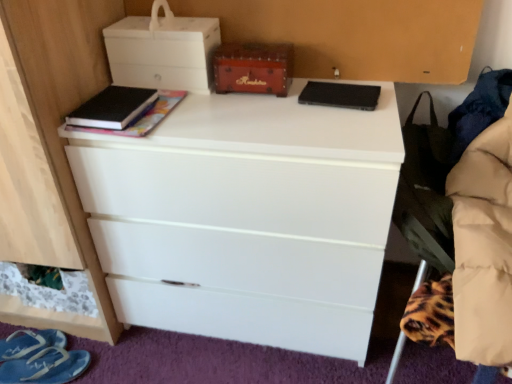
You are a GUI agent. You are given a task and a screenshot of the screen. Output one action in this format:
    pyautogui.click(x=<x>, y=<y>)
    Task: Click on the vacant space to the right of black matte book at upper left, acting as the 2th book starting from the right
    
    Given the screenshot: What is the action you would take?
    pyautogui.click(x=189, y=112)